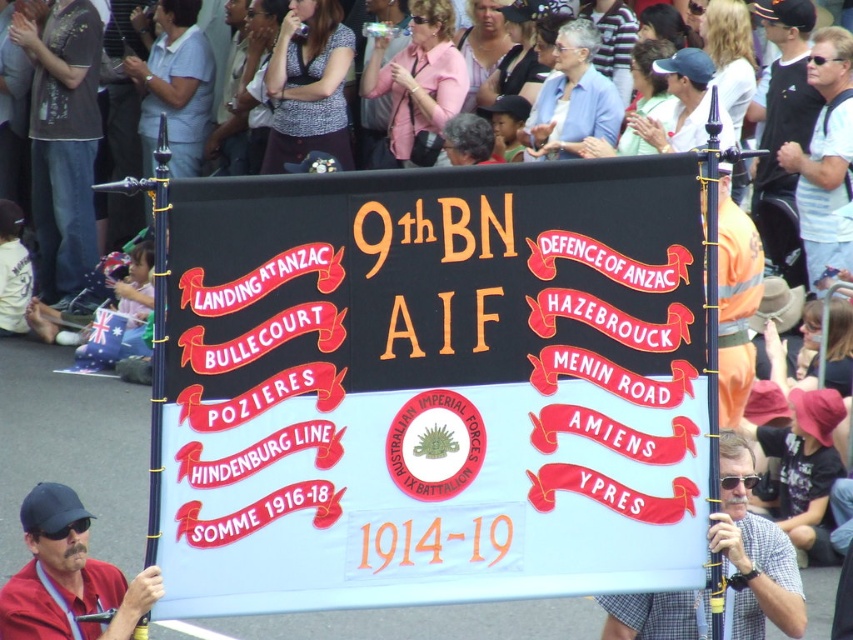
Can you confirm if red fabric cap at lower left is wider than white striped shirt at upper right?

No.

Find the location of `red fabric cap at lower left`. red fabric cap at lower left is located at coordinates (68, 577).

Where is `red fabric cap at lower left`? This screenshot has height=640, width=853. red fabric cap at lower left is located at coordinates (68, 577).

Can you confirm if dark gray shirt at center is thinner than red fabric cap at lower left?

No, dark gray shirt at center is not thinner than red fabric cap at lower left.

Is point (16, 12) positioned after point (45, 618)?

That is True.

Which is in front, point (96, 240) or point (97, 584)?

Point (97, 584)

Find the location of a particular element. The height and width of the screenshot is (640, 853). dark gray shirt at center is located at coordinates (62, 140).

Does black fabric banner at center have a greater height compared to white striped shirt at upper right?

No, black fabric banner at center is not taller than white striped shirt at upper right.

Which of these two, black fabric banner at center or white striped shirt at upper right, stands taller?

white striped shirt at upper right is taller.

Which is in front, point (494, 456) or point (822, 211)?

Positioned in front is point (494, 456).

The image size is (853, 640). What are the coordinates of `black fabric banner at center` in the screenshot? It's located at (432, 387).